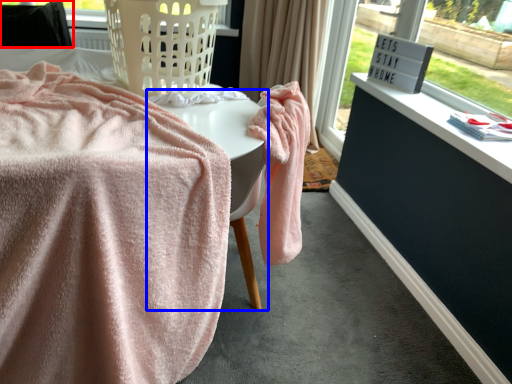
Question: Which object is further to the camera taking this photo, furniture (highlighted by a red box) or table (highlighted by a blue box)?

Choices:
 (A) furniture
 (B) table

Answer: (A)